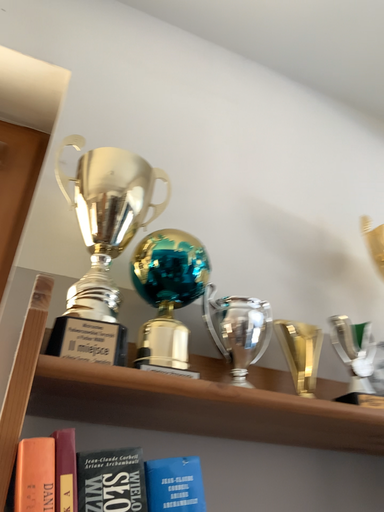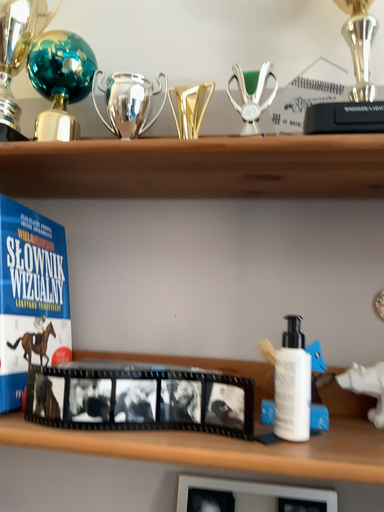
Question: Which way did the camera rotate in the video?

Choices:
 (A) rotated downward
 (B) rotated upward

Answer: (A)